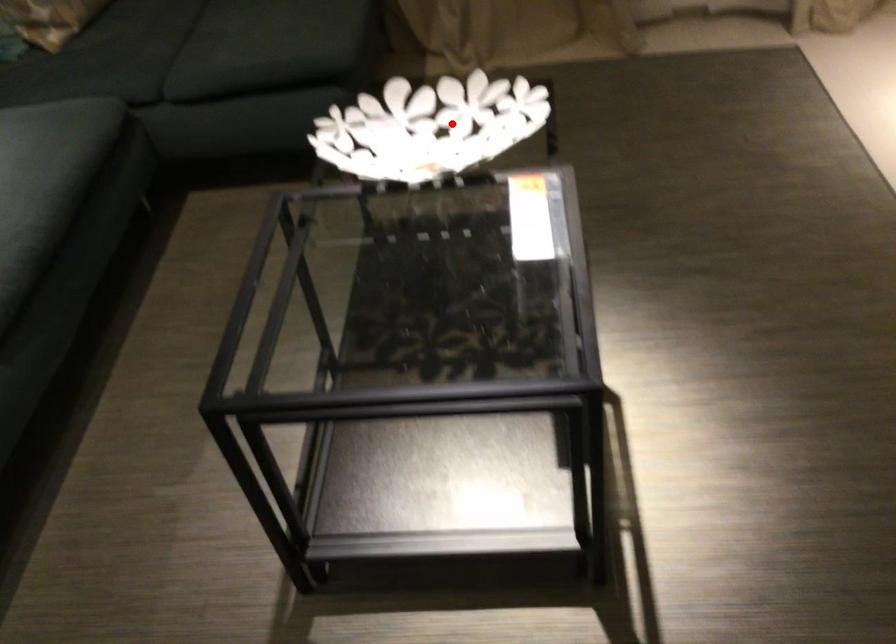
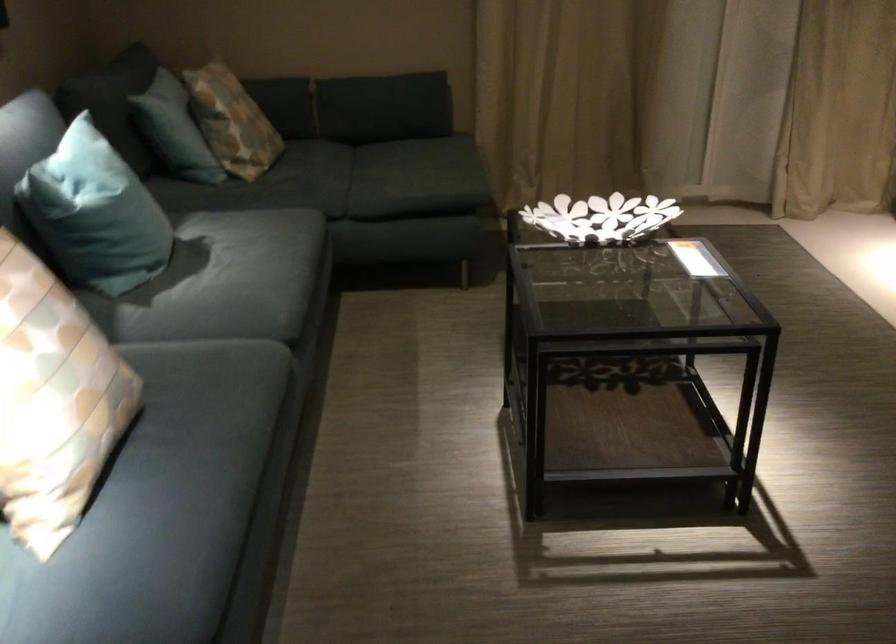
Where in the second image is the point corresponding to the highlighted location from the first image?

(600, 218)